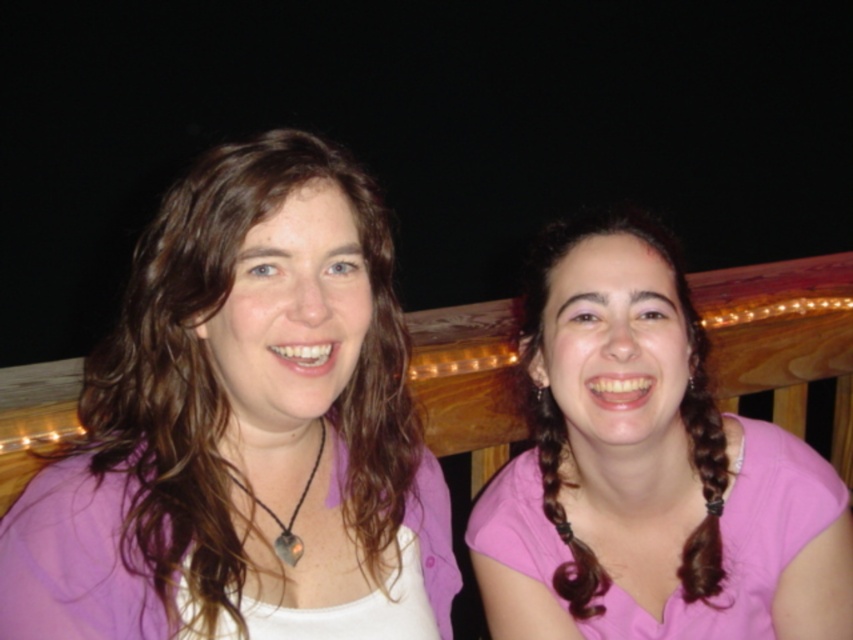
You are standing 1 meter away from the wooden railing where the two people are sitting. You want to place a small gift exactly at point (247, 525). Can you reach that point without moving closer than 0.5 meters to the railing?

The distance of point (247, 525) from viewer is 72.63 centimeters. Since you are standing 1 meter away from the railing and need to stay at least 0.5 meters away, the minimum distance you can reach is 0.5 meters. The point is 72.63 cm away, which is within the 0.5 meter limit, so yes, you can reach it.

You are a photographer standing 10 inches away from the two people in the scene. You want to take a photo of both the matte purple shirt at center and the pink matte shirt at right without moving your position. Can you capture both shirts in the same frame?

The matte purple shirt at center is 9.86 inches away from the pink matte shirt at right. Since you are standing 10 inches away from them, the distance between the shirts is less than your distance from them. This means both shirts will be within your field of view, so yes, you can capture both shirts in the same frame.

You are a photographer setting up a lighting rig for a portrait session. You need to ensure that both the matte purple shirt at center and the pink matte shirt at right are evenly lit. Given their positions, which shirt should you adjust the lighting to focus on first?

The matte purple shirt at center is located above the pink matte shirt at right, so you should adjust the lighting to focus on the matte purple shirt at center first to ensure proper illumination from top to bottom.